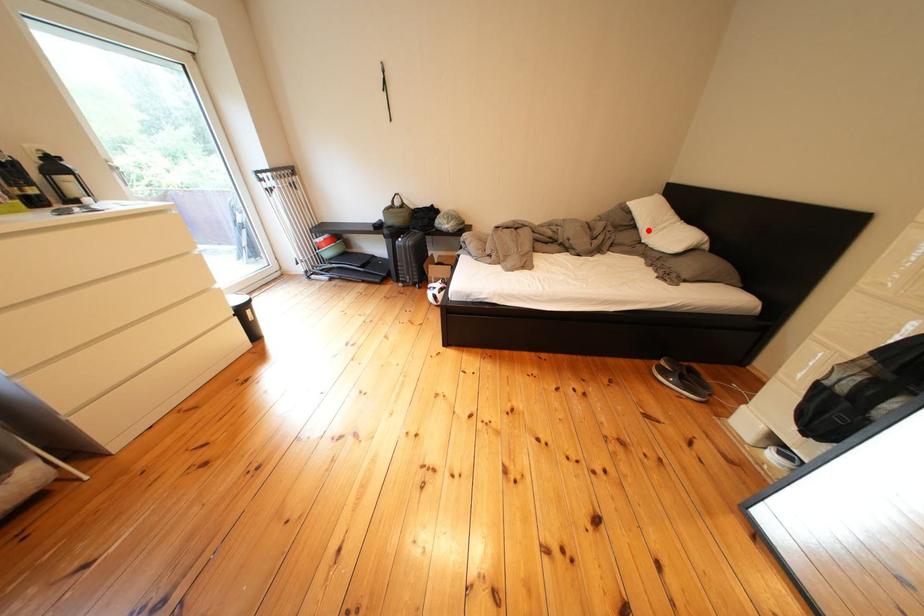
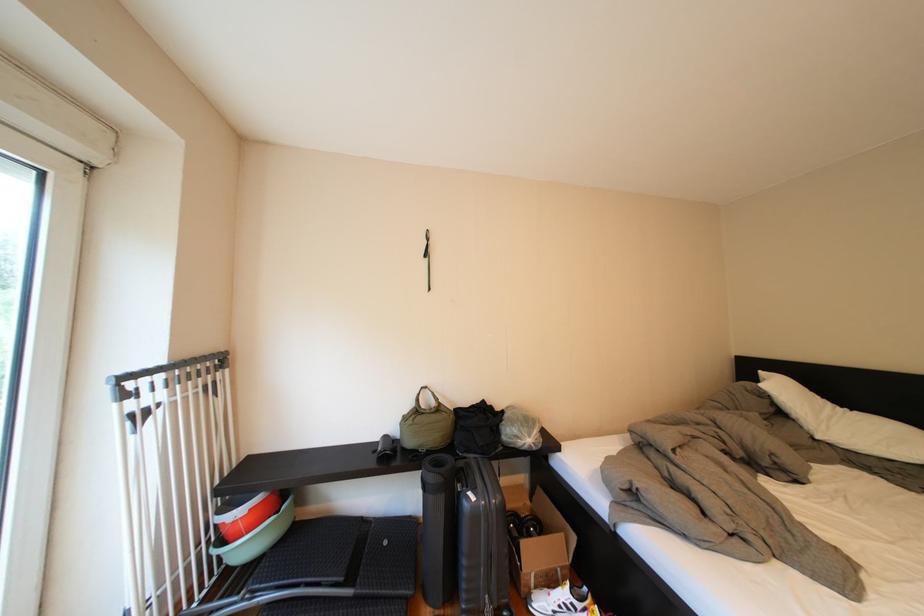
In the second image, find the point that corresponds to the highlighted location in the first image.

(795, 419)